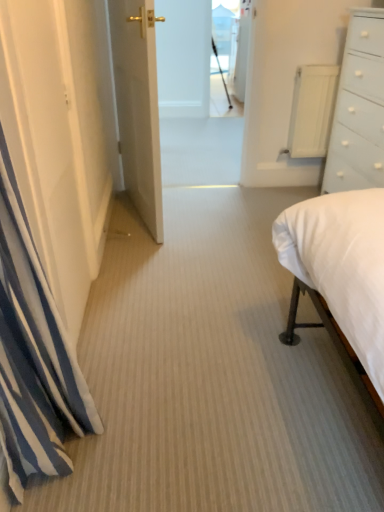
Question: From a real-world perspective, is white painted wood chest of drawers at right positioned over white striped curtain at left based on gravity?

Choices:
 (A) no
 (B) yes

Answer: (A)

Question: From the image's perspective, is white painted wood chest of drawers at right located beneath white striped curtain at left?

Choices:
 (A) yes
 (B) no

Answer: (B)

Question: Are white painted wood chest of drawers at right and white striped curtain at left beside each other?

Choices:
 (A) yes
 (B) no

Answer: (B)

Question: Is white painted wood chest of drawers at right closer to camera compared to white striped curtain at left?

Choices:
 (A) yes
 (B) no

Answer: (B)

Question: Is there a large distance between white painted wood chest of drawers at right and white striped curtain at left?

Choices:
 (A) no
 (B) yes

Answer: (B)

Question: Relative to transparent glass door at upper center, is white glossy door at center in front or behind?

Choices:
 (A) behind
 (B) front

Answer: (B)

Question: Does point (129, 116) appear closer or farther from the camera than point (235, 72)?

Choices:
 (A) farther
 (B) closer

Answer: (B)

Question: From the image's perspective, is white glossy door at center located above or below transparent glass door at upper center?

Choices:
 (A) below
 (B) above

Answer: (A)

Question: Looking at the image, does white glossy door at center seem bigger or smaller compared to transparent glass door at upper center?

Choices:
 (A) big
 (B) small

Answer: (A)

Question: Is white glossy door at center taller or shorter than white striped curtain at left?

Choices:
 (A) short
 (B) tall

Answer: (B)

Question: Looking at the image, does white glossy door at center seem bigger or smaller compared to white striped curtain at left?

Choices:
 (A) big
 (B) small

Answer: (A)

Question: Which is correct: white glossy door at center is inside white striped curtain at left, or outside of it?

Choices:
 (A) inside
 (B) outside

Answer: (B)

Question: From the image's perspective, is white glossy door at center located above or below white striped curtain at left?

Choices:
 (A) above
 (B) below

Answer: (A)

Question: Considering their positions, is transparent glass door at upper center located in front of or behind white painted wood chest of drawers at right?

Choices:
 (A) front
 (B) behind

Answer: (B)

Question: In terms of width, does transparent glass door at upper center look wider or thinner when compared to white painted wood chest of drawers at right?

Choices:
 (A) wide
 (B) thin

Answer: (B)